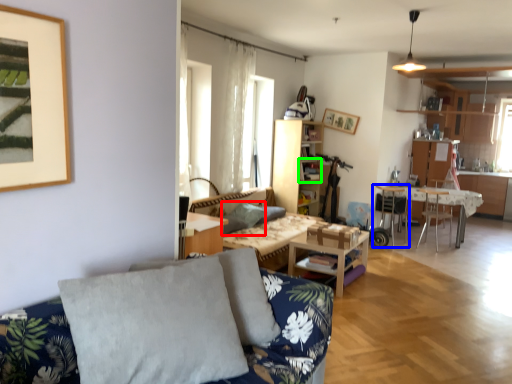
Question: Which object is positioned closest to pillow (highlighted by a red box)? Select from chair (highlighted by a blue box) and shelf (highlighted by a green box).

Choices:
 (A) chair
 (B) shelf

Answer: (B)